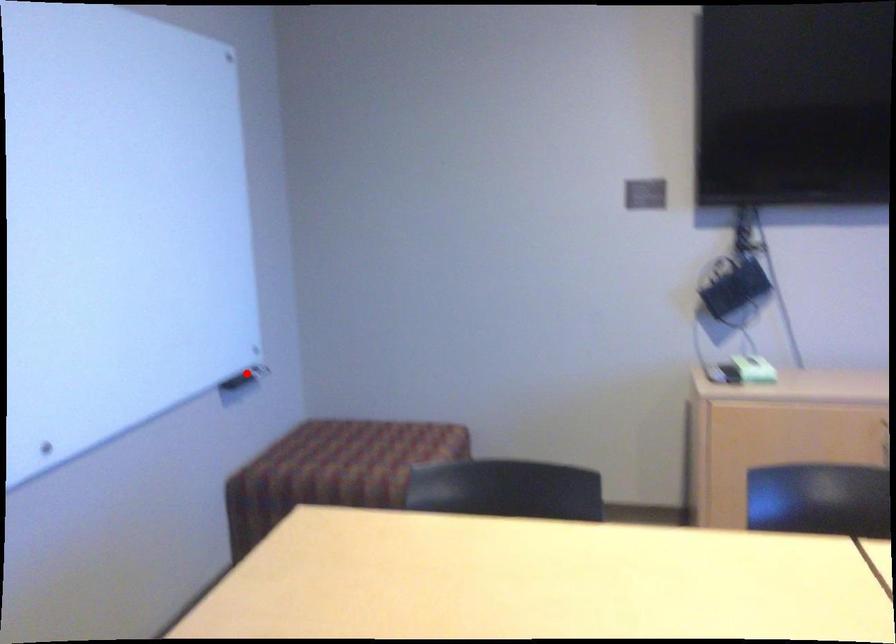
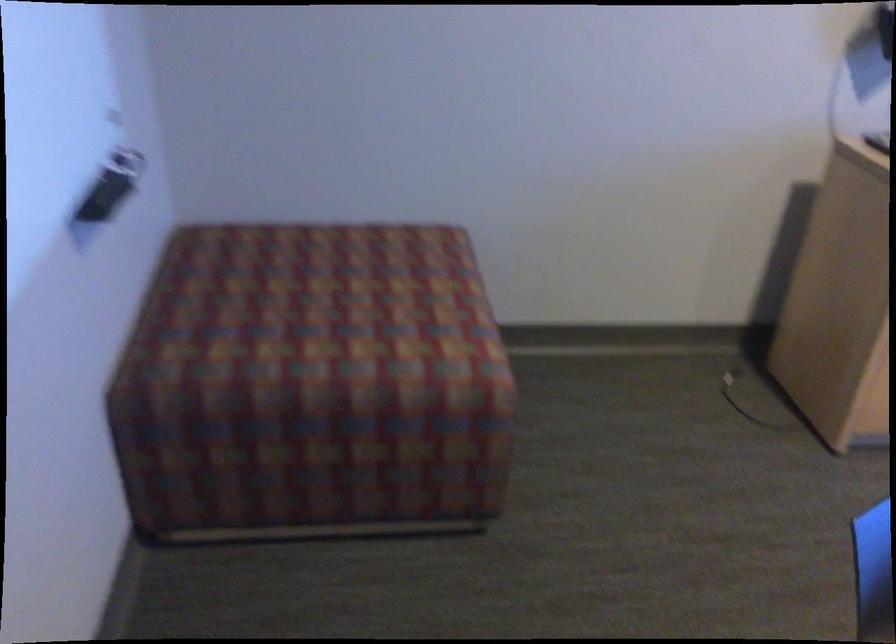
Question: I am providing you with two images of the same scene from different viewpoints. A red point is marked on the first image. Is the red point's position out of view in image 2?

Choices:
 (A) Yes
 (B) No

Answer: (A)